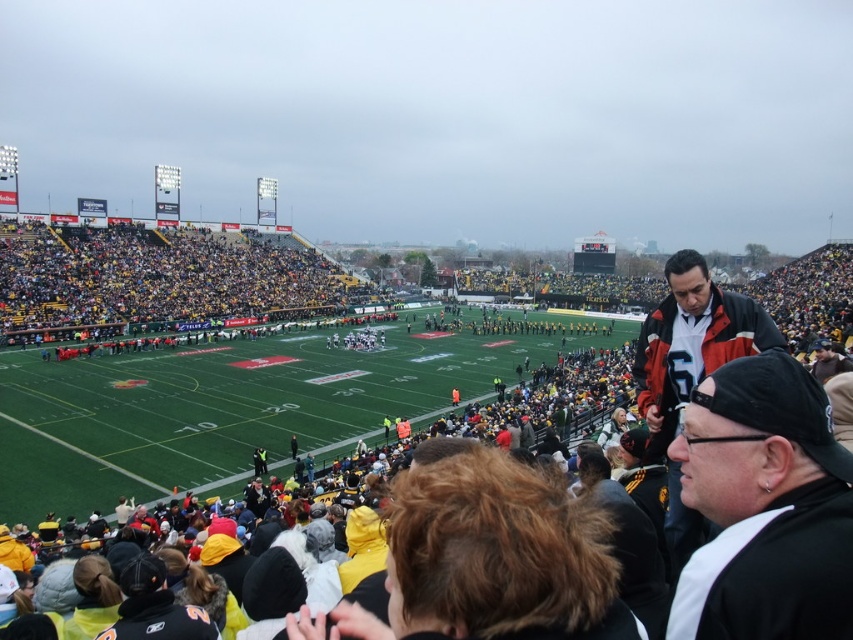
Can you confirm if black matte cap at upper right is positioned above matte black jacket at center?

No.

From the picture: Does black matte cap at upper right appear under matte black jacket at center?

Yes, black matte cap at upper right is below matte black jacket at center.

Where is `black matte cap at upper right`? The width and height of the screenshot is (853, 640). black matte cap at upper right is located at coordinates (764, 508).